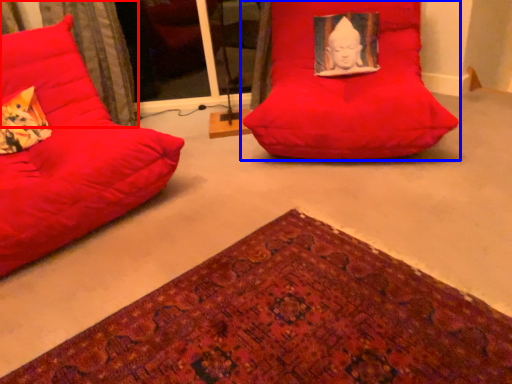
Question: Which object appears closest to the camera in this image, curtain (highlighted by a red box) or furniture (highlighted by a blue box)?

Choices:
 (A) curtain
 (B) furniture

Answer: (B)